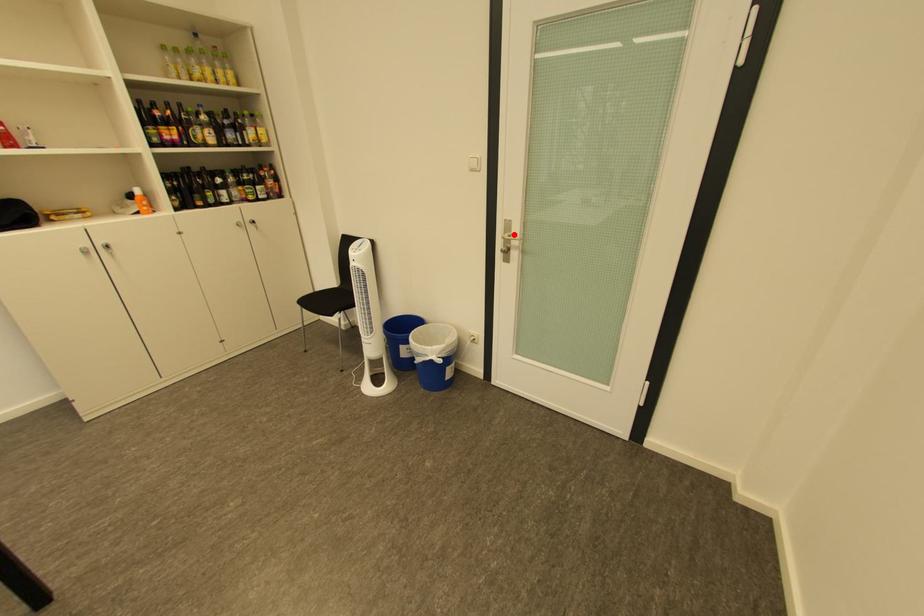
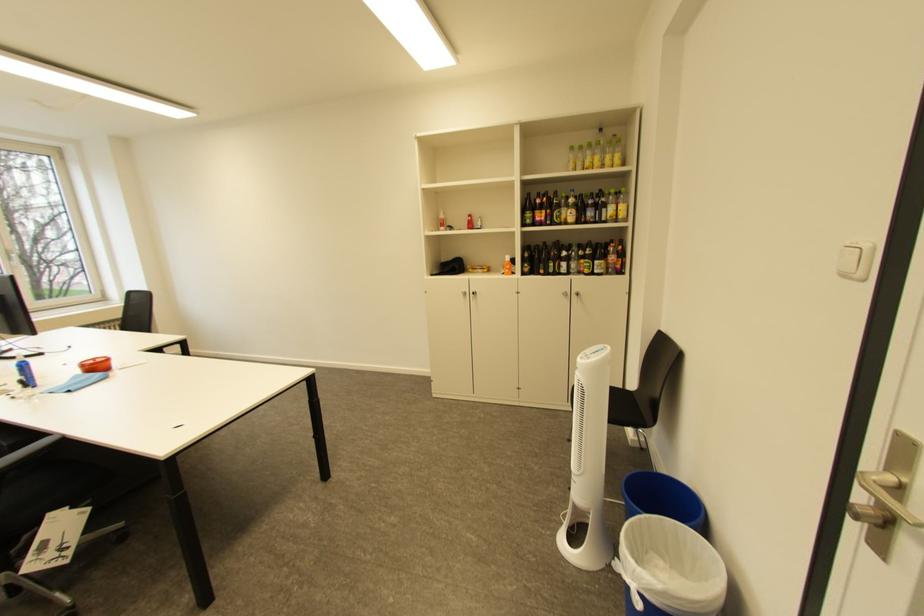
Locate, in the second image, the point that corresponds to the highlighted location in the first image.

(898, 472)